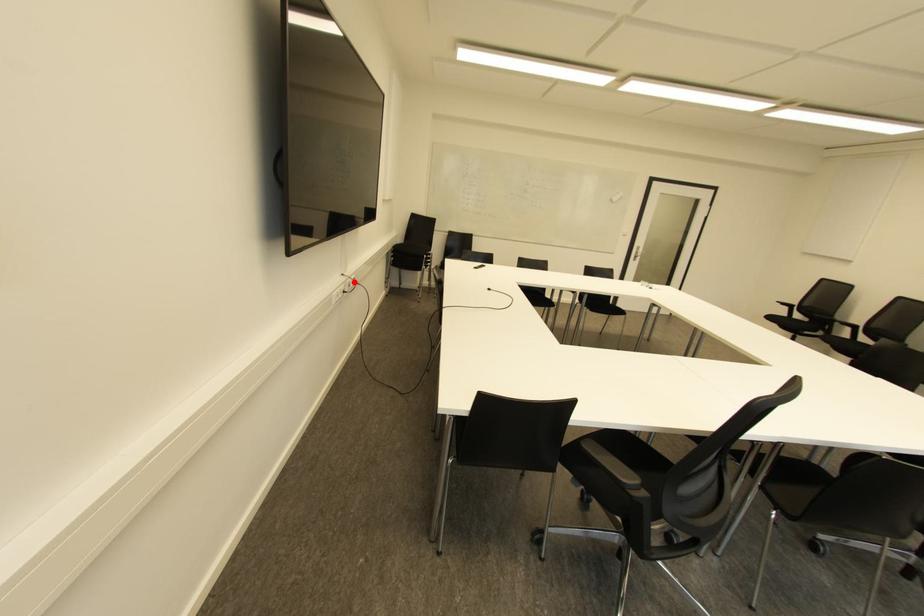
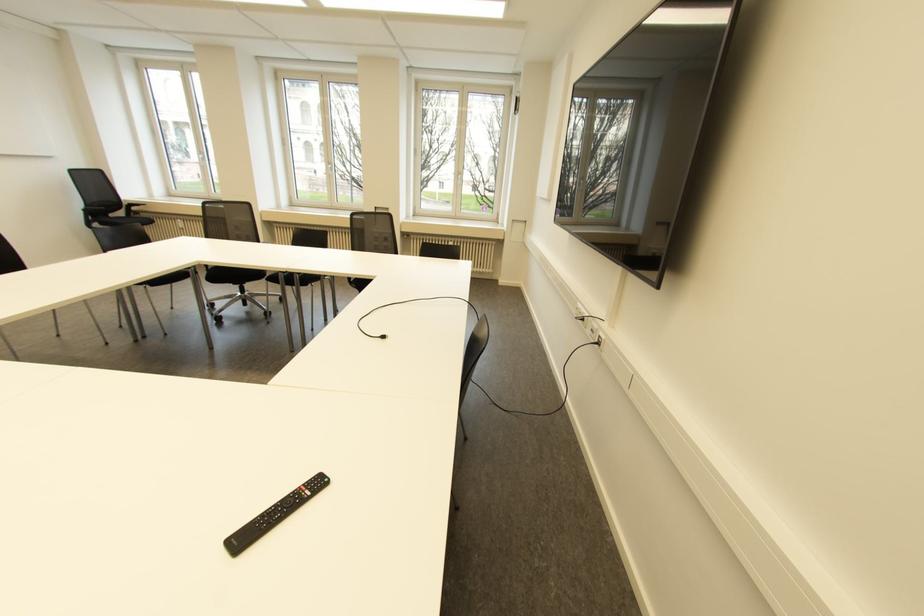
Question: I am providing you with two images of the same scene from different viewpoints. Image1 has a red point marked. In image2, the corresponding 3D location appears at what relative position? Reply with the corresponding letter.

Choices:
 (A) Closer
 (B) Farther

Answer: (B)